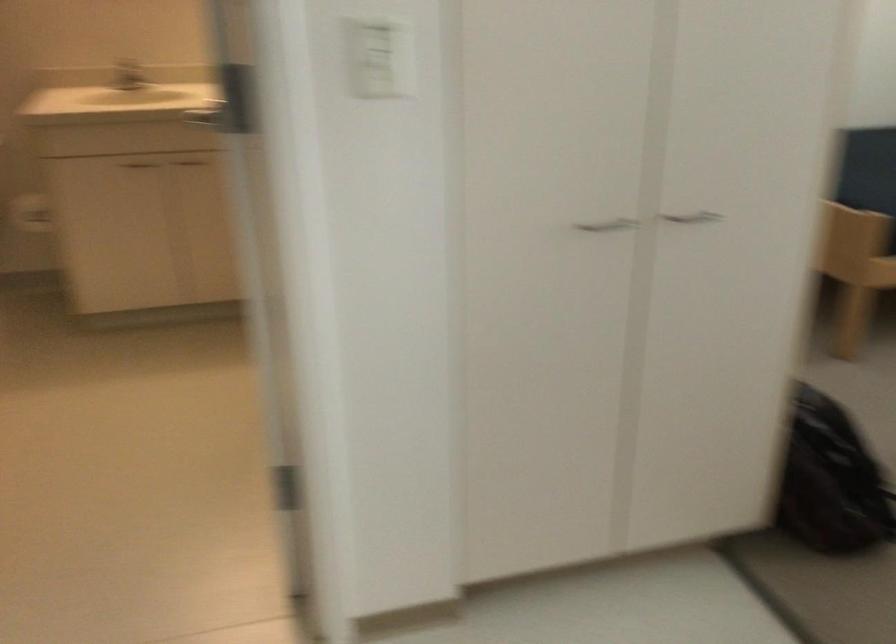
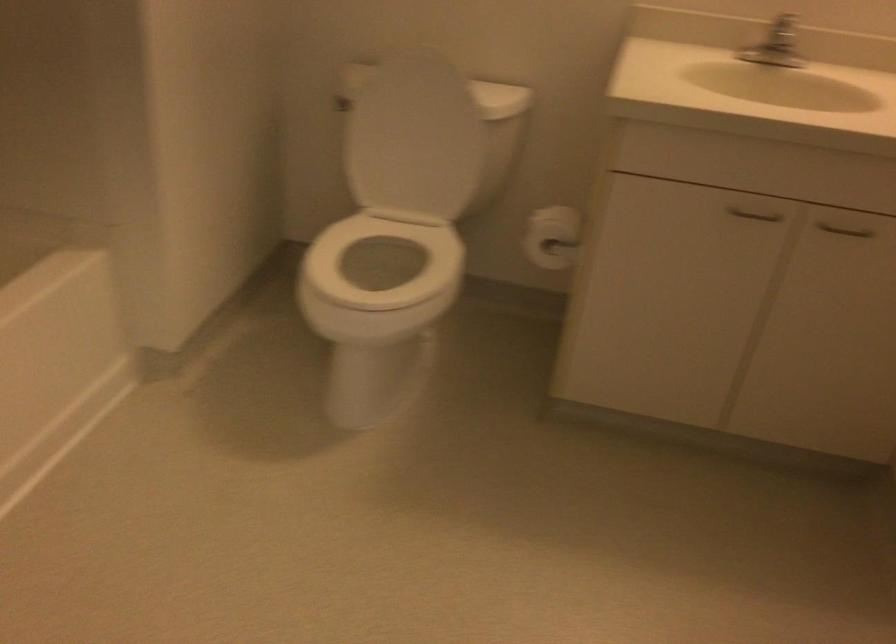
The point at [186,160] is marked in the first image. Where is the corresponding point in the second image?

(845, 230)